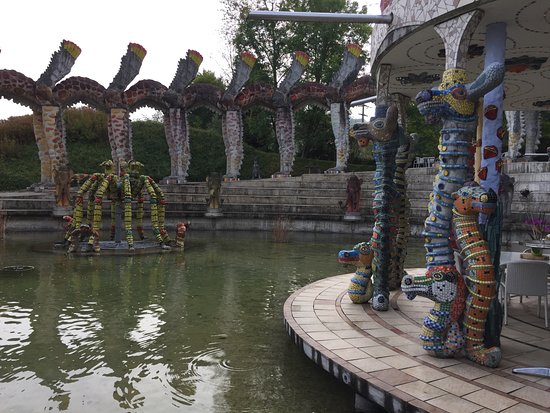
Where is `ceiling of structure`? ceiling of structure is located at coordinates (396, 53).